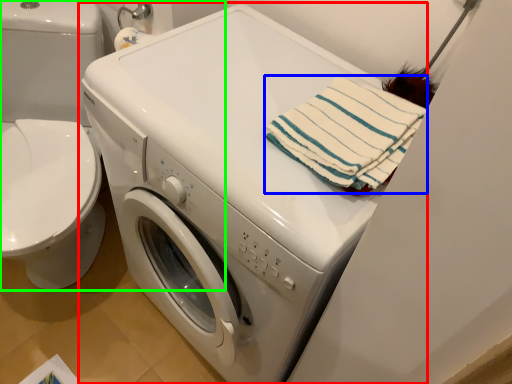
Question: Based on their relative distances, which object is nearer to washing machine (highlighted by a red box)? Choose from beach towel (highlighted by a blue box) and washer (highlighted by a green box).

Choices:
 (A) beach towel
 (B) washer

Answer: (A)